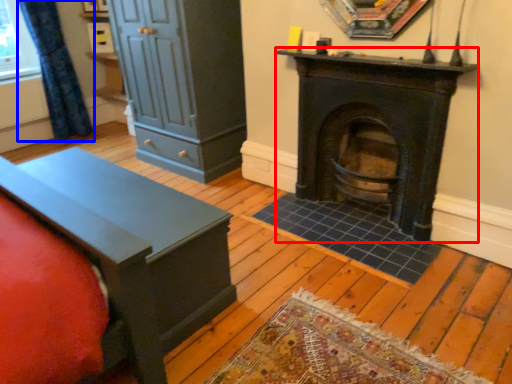
Question: Which point is closer to the camera, wood burning stove (highlighted by a red box) or curtain (highlighted by a blue box)?

Choices:
 (A) wood burning stove
 (B) curtain

Answer: (A)